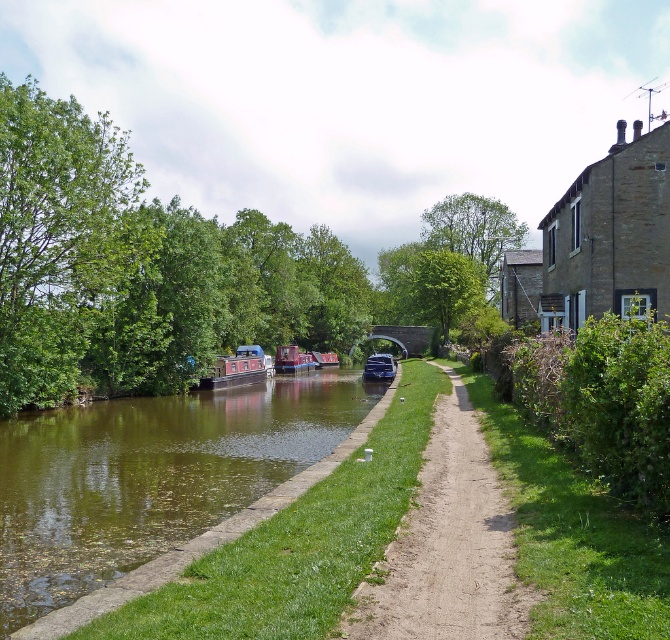
You are standing on the dirt path next to the canal and want to look at the matte blue boat at center. Which direction should you look to see the green smooth water at center?

The green smooth water at center is located below the matte blue boat at center, so you should look downward from the matte blue boat at center to see the green smooth water at center.

Consider the image. You are a photographer planning to take a photo of the canal boats. You want to include both the matte red canal boat at center and the matte blue boat at center in your shot. Which boat should you position closer to the camera to ensure both are fully visible in the frame?

To ensure both the matte red canal boat at center and the matte blue boat at center are fully visible in the frame, you should position the smaller matte red canal boat at center closer to the camera. Since it is smaller, placing it nearer will help maintain its size relative to the larger matte blue boat at center, ensuring both fit well within the photo.

In the scene shown: You are standing on the dirt path next to the canal and see the green smooth water at center and the matte red canal boat at center. Which object is closer to the grassy bank?

The matte red canal boat at center is closer to the grassy bank because the green smooth water at center is to the right of it, implying the boat is positioned between the water and the grass.